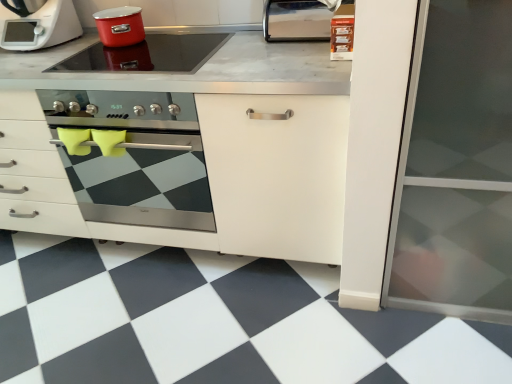
Question: Considering the relative positions of white matte food processor at upper left and black/white checkered tile at lower center in the image provided, is white matte food processor at upper left in front of black/white checkered tile at lower center?

Choices:
 (A) no
 (B) yes

Answer: (A)

Question: Considering the relative sizes of white matte food processor at upper left and black/white checkered tile at lower center in the image provided, is white matte food processor at upper left shorter than black/white checkered tile at lower center?

Choices:
 (A) yes
 (B) no

Answer: (B)

Question: From a real-world perspective, does white matte food processor at upper left stand above black/white checkered tile at lower center?

Choices:
 (A) yes
 (B) no

Answer: (A)

Question: Can you see white matte food processor at upper left touching black/white checkered tile at lower center?

Choices:
 (A) no
 (B) yes

Answer: (A)

Question: Is white matte food processor at upper left oriented away from black/white checkered tile at lower center?

Choices:
 (A) yes
 (B) no

Answer: (B)

Question: Would you say white matte cabinet at center is inside or outside stainless steel oven at center?

Choices:
 (A) outside
 (B) inside

Answer: (A)

Question: From a real-world perspective, is white matte cabinet at center positioned above or below stainless steel oven at center?

Choices:
 (A) below
 (B) above

Answer: (A)

Question: Is point (162, 117) closer or farther from the camera than point (165, 220)?

Choices:
 (A) closer
 (B) farther

Answer: (A)

Question: Is white matte cabinet at center taller or shorter than stainless steel oven at center?

Choices:
 (A) short
 (B) tall

Answer: (B)

Question: Is stainless steel oven at center inside or outside of black/white checkered tile at lower center?

Choices:
 (A) inside
 (B) outside

Answer: (B)

Question: Based on their sizes in the image, would you say stainless steel oven at center is bigger or smaller than black/white checkered tile at lower center?

Choices:
 (A) big
 (B) small

Answer: (A)

Question: From a real-world perspective, is stainless steel oven at center physically located above or below black/white checkered tile at lower center?

Choices:
 (A) above
 (B) below

Answer: (A)

Question: Does point [x=116, y=94] appear closer or farther from the camera than point [x=27, y=249]?

Choices:
 (A) farther
 (B) closer

Answer: (A)

Question: In the image, is matte red pot at upper center, the second kitchen appliance positioned from the bottom, positioned in front of or behind smooth glass cooktop at upper center, which is the first kitchen appliance in bottom-to-top order?

Choices:
 (A) front
 (B) behind

Answer: (B)

Question: Based on their sizes in the image, would you say matte red pot at upper center, the second kitchen appliance positioned from the bottom, is bigger or smaller than smooth glass cooktop at upper center, the 2th kitchen appliance positioned from the top?

Choices:
 (A) big
 (B) small

Answer: (A)